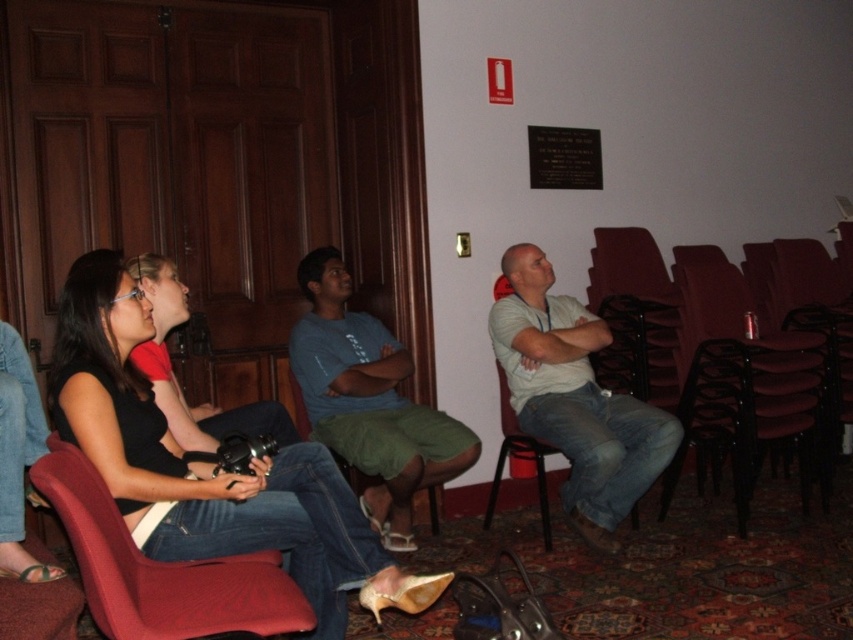
Can you confirm if blue cotton shirt at center is positioned below matte black camera at left?

Yes.

Does blue cotton shirt at center have a lesser height compared to matte black camera at left?

In fact, blue cotton shirt at center may be taller than matte black camera at left.

Locate an element on the screen. This screenshot has width=853, height=640. blue cotton shirt at center is located at coordinates (369, 401).

Image resolution: width=853 pixels, height=640 pixels. Identify the location of blue cotton shirt at center. [369, 401].

Can you confirm if blue cotton shirt at center is positioned to the right of green fabric shorts at center?

Incorrect, blue cotton shirt at center is not on the right side of green fabric shorts at center.

Is point (339, 352) farther from viewer compared to point (297, 412)?

No, it is in front of (297, 412).

Between point (463, 451) and point (299, 404), which one is positioned in front?

Positioned in front is point (463, 451).

Find the location of a particular element. This screenshot has height=640, width=853. blue cotton shirt at center is located at coordinates (369, 401).

Is light gray cotton shirt at center closer to camera compared to black plastic chair at center?

Yes, light gray cotton shirt at center is closer to the viewer.

Between light gray cotton shirt at center and black plastic chair at center, which one appears on the right side from the viewer's perspective?

light gray cotton shirt at center

Locate an element on the screen. The height and width of the screenshot is (640, 853). light gray cotton shirt at center is located at coordinates (575, 397).